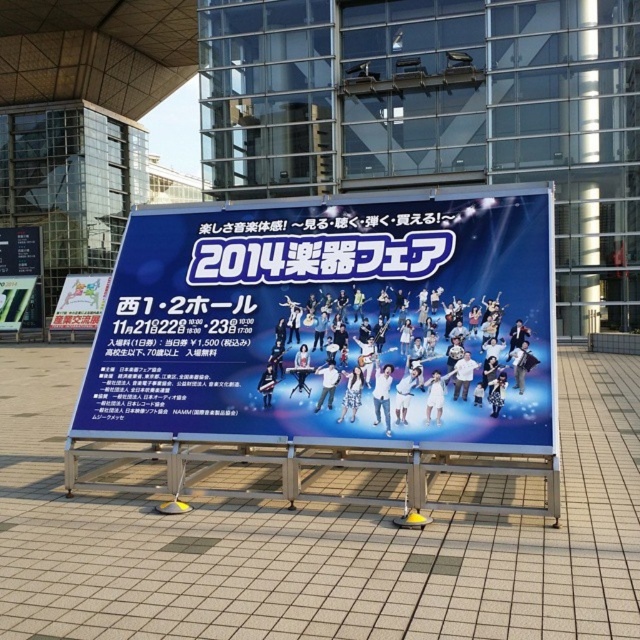
Question: Is blue fabric billboard at center wider than metallic silver sign at lower left?

Choices:
 (A) no
 (B) yes

Answer: (B)

Question: Which of the following is the farthest from the observer?

Choices:
 (A) (289, 282)
 (B) (1, 276)

Answer: (B)

Question: Is blue fabric billboard at center to the right of white paper at lower left from the viewer's perspective?

Choices:
 (A) no
 (B) yes

Answer: (B)

Question: Which object is closer to the camera taking this photo?

Choices:
 (A) white paper at lower left
 (B) blue fabric billboard at center
 (C) metallic silver sign at lower left

Answer: (B)

Question: Which point is farther to the camera?

Choices:
 (A) (444, 344)
 (B) (60, 294)
 (C) (26, 300)

Answer: (B)

Question: Can you confirm if white paper at lower left is smaller than metallic silver sign at lower left?

Choices:
 (A) no
 (B) yes

Answer: (B)